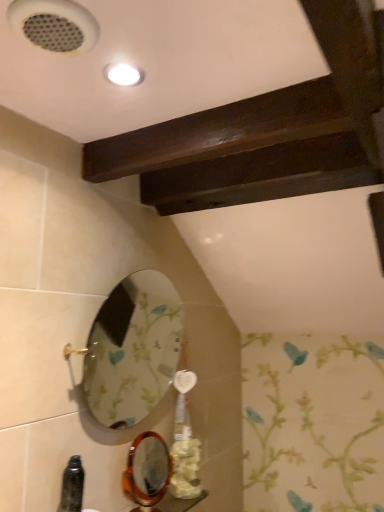
Question: Is oval glass mirror at lower left next to white matte flower at lower center and touching it?

Choices:
 (A) no
 (B) yes

Answer: (A)

Question: Is oval glass mirror at lower left bigger than white matte flower at lower center?

Choices:
 (A) yes
 (B) no

Answer: (A)

Question: From the image's perspective, is oval glass mirror at lower left beneath white matte flower at lower center?

Choices:
 (A) yes
 (B) no

Answer: (B)

Question: Is oval glass mirror at lower left not near white matte flower at lower center?

Choices:
 (A) no
 (B) yes

Answer: (A)

Question: Considering the relative positions of oval glass mirror at lower left and white matte flower at lower center in the image provided, is oval glass mirror at lower left to the right of white matte flower at lower center from the viewer's perspective?

Choices:
 (A) yes
 (B) no

Answer: (B)

Question: Can you confirm if oval glass mirror at lower left is thinner than white matte flower at lower center?

Choices:
 (A) no
 (B) yes

Answer: (A)

Question: Considering the relative sizes of white matte flower at lower center and oval glass mirror at lower left in the image provided, is white matte flower at lower center smaller than oval glass mirror at lower left?

Choices:
 (A) no
 (B) yes

Answer: (B)

Question: Can we say white matte flower at lower center lies outside oval glass mirror at lower left?

Choices:
 (A) yes
 (B) no

Answer: (A)

Question: Is oval glass mirror at lower left inside white matte flower at lower center?

Choices:
 (A) yes
 (B) no

Answer: (B)

Question: Does white matte flower at lower center have a larger size compared to oval glass mirror at lower left?

Choices:
 (A) yes
 (B) no

Answer: (B)

Question: From a real-world perspective, is white matte flower at lower center over oval glass mirror at lower left?

Choices:
 (A) yes
 (B) no

Answer: (B)

Question: Is white matte flower at lower center at the left side of oval glass mirror at lower left?

Choices:
 (A) yes
 (B) no

Answer: (B)

Question: Considering the positions of point (178, 449) and point (107, 335), is point (178, 449) closer or farther from the camera than point (107, 335)?

Choices:
 (A) closer
 (B) farther

Answer: (A)